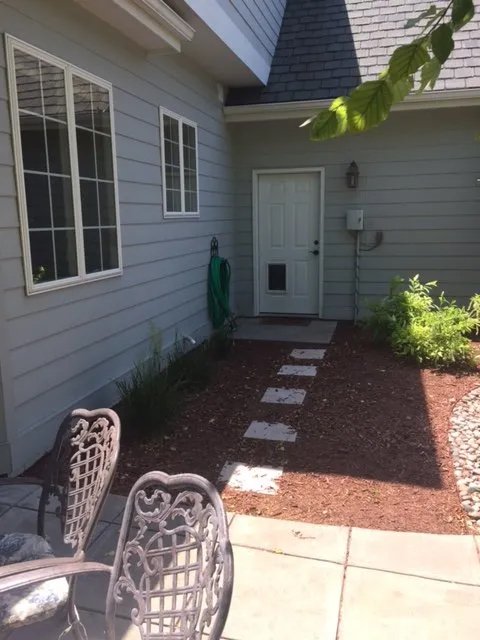
This screenshot has height=640, width=480. I want to click on seat of the chair, so click(x=39, y=595).